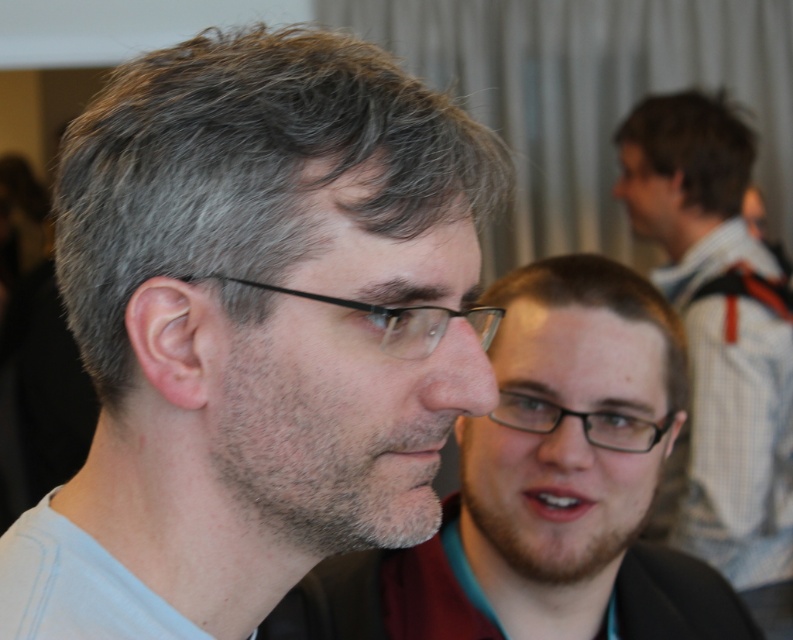
Question: Which object appears closest to the camera in this image?

Choices:
 (A) black plastic glasses at left
 (B) black plastic glasses at center

Answer: (A)

Question: Which point appears closest to the camera in this image?

Choices:
 (A) (435, 320)
 (B) (548, 573)

Answer: (A)

Question: Is gray matte glasses at center to the right of dark brown hair at upper right from the viewer's perspective?

Choices:
 (A) no
 (B) yes

Answer: (A)

Question: Which point is closer to the camera taking this photo?

Choices:
 (A) (491, 490)
 (B) (738, 477)
 (C) (715, 198)

Answer: (A)

Question: Observing the image, what is the correct spatial positioning of light brown hair at right in reference to black plastic glasses at left?

Choices:
 (A) below
 (B) above

Answer: (B)

Question: Is gray matte glasses at center to the right of light brown hair at right from the viewer's perspective?

Choices:
 (A) yes
 (B) no

Answer: (B)